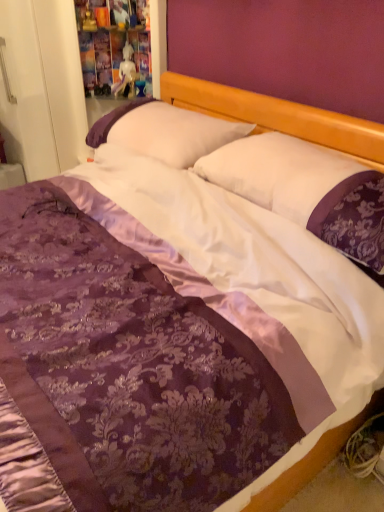
Looking at this image, how much space does white satin pillow at center, which appears as the first pillow when viewed from the back, occupy horizontally?

white satin pillow at center, which appears as the first pillow when viewed from the back, is 16.54 inches wide.

Describe the element at coordinates (126, 74) in the screenshot. Image resolution: width=384 pixels, height=512 pixels. I see `white glossy statue at upper center` at that location.

I want to click on white satin pillow at center, the second pillow viewed from the back, so click(307, 191).

In the scene shown: From the image's perspective, does white satin pillow at center, which appears as the first pillow when viewed from the back, appear lower than white glossy statue at upper center?

Yes, from the image's perspective, white satin pillow at center, which appears as the first pillow when viewed from the back, is beneath white glossy statue at upper center.

Find the location of a particular element. This screenshot has height=512, width=384. doll on the left of the white satin pillow at center, the second pillow viewed from the front is located at coordinates (126, 74).

Looking at this image, does white satin pillow at center, which appears as the first pillow when viewed from the back, appear on the right side of white glossy statue at upper center?

Correct, you'll find white satin pillow at center, which appears as the first pillow when viewed from the back, to the right of white glossy statue at upper center.

Which is behind, white satin pillow at center, the second pillow viewed from the front, or white glossy statue at upper center?

white glossy statue at upper center is further from the camera.

Does white satin pillow at center, the second pillow viewed from the back, have a smaller size compared to white glossy statue at upper center?

No, white satin pillow at center, the second pillow viewed from the back, is not smaller than white glossy statue at upper center.

Is white satin pillow at center, the second pillow viewed from the back, with white glossy statue at upper center?

white satin pillow at center, the second pillow viewed from the back, is not next to white glossy statue at upper center, and they're not touching.

Is white satin pillow at center, the 1th pillow positioned from the front, at the left side of white glossy statue at upper center?

No, white satin pillow at center, the 1th pillow positioned from the front, is not to the left of white glossy statue at upper center.

How different are the orientations of white satin pillow at center, the 1th pillow positioned from the front, and white glossy statue at upper center in degrees?

There is a 53-degree angle between the facing directions of white satin pillow at center, the 1th pillow positioned from the front, and white glossy statue at upper center.

Where is `doll on the left of white satin pillow at center, the second pillow viewed from the back`? This screenshot has width=384, height=512. doll on the left of white satin pillow at center, the second pillow viewed from the back is located at coordinates (126, 74).

Which object is thinner, white glossy statue at upper center or white satin pillow at center, the 1th pillow positioned from the front?

white glossy statue at upper center is thinner.

Could you tell me if white glossy statue at upper center is facing white satin pillow at center, the second pillow viewed from the back?

No, white glossy statue at upper center is not facing towards white satin pillow at center, the second pillow viewed from the back.

Where is `pillow behind the white satin pillow at center, the 1th pillow positioned from the front`? This screenshot has width=384, height=512. pillow behind the white satin pillow at center, the 1th pillow positioned from the front is located at coordinates (165, 131).

Based on the photo, from the image's perspective, is white satin pillow at center, the second pillow viewed from the front, located above or below white satin pillow at center, the 1th pillow positioned from the front?

From the image's perspective, white satin pillow at center, the second pillow viewed from the front, appears above white satin pillow at center, the 1th pillow positioned from the front.

Can you tell me how much white satin pillow at center, which appears as the first pillow when viewed from the back, and white satin pillow at center, the second pillow viewed from the back, differ in facing direction?

0.355 degrees separate the facing orientations of white satin pillow at center, which appears as the first pillow when viewed from the back, and white satin pillow at center, the second pillow viewed from the back.

Do you think white satin pillow at center, the 1th pillow positioned from the front, is within white satin pillow at center, which appears as the first pillow when viewed from the back, or outside of it?

white satin pillow at center, the 1th pillow positioned from the front, is not enclosed by white satin pillow at center, which appears as the first pillow when viewed from the back.

Is point (356, 263) positioned before point (135, 112)?

Yes.

Is white satin pillow at center, the second pillow viewed from the back, turned away from white satin pillow at center, the second pillow viewed from the front?

white satin pillow at center, the second pillow viewed from the back, does not have its back to white satin pillow at center, the second pillow viewed from the front.

Locate an element on the screen. The image size is (384, 512). pillow on the right side of white satin pillow at center, which appears as the first pillow when viewed from the back is located at coordinates (307, 191).

How different are the orientations of white glossy statue at upper center and white satin pillow at center, which appears as the first pillow when viewed from the back, in degrees?

The angular difference between white glossy statue at upper center and white satin pillow at center, which appears as the first pillow when viewed from the back, is 52.6 degrees.

Is white glossy statue at upper center taller than white satin pillow at center, the second pillow viewed from the front?

Indeed, white glossy statue at upper center has a greater height compared to white satin pillow at center, the second pillow viewed from the front.

Is white glossy statue at upper center to the left or to the right of white satin pillow at center, the second pillow viewed from the front, in the image?

white glossy statue at upper center is positioned on white satin pillow at center, the second pillow viewed from the front,'s left side.

Starting from the white glossy statue at upper center, which pillow is the 1st one in front? Please provide its 2D coordinates.

[(165, 131)]

Locate an element on the screen. The image size is (384, 512). doll lying above the white satin pillow at center, the second pillow viewed from the back (from the image's perspective) is located at coordinates (x=126, y=74).

Considering their positions, is white glossy statue at upper center positioned further to white satin pillow at center, the second pillow viewed from the back, than white satin pillow at center, the second pillow viewed from the front?

white glossy statue at upper center.

Considering their positions, is white satin pillow at center, the second pillow viewed from the back, positioned closer to white satin pillow at center, the second pillow viewed from the front, than white glossy statue at upper center?

Based on the image, white satin pillow at center, the second pillow viewed from the back, appears to be nearer to white satin pillow at center, the second pillow viewed from the front.

Looking at the image, which one is located closer to white glossy statue at upper center, white satin pillow at center, the second pillow viewed from the front, or white satin pillow at center, the 1th pillow positioned from the front?

white satin pillow at center, the second pillow viewed from the front.

Looking at the image, which one is located closer to white satin pillow at center, which appears as the first pillow when viewed from the back, white glossy statue at upper center or white satin pillow at center, the second pillow viewed from the back?

Based on the image, white satin pillow at center, the second pillow viewed from the back, appears to be nearer to white satin pillow at center, which appears as the first pillow when viewed from the back.

Estimate the real-world distances between objects in this image. Which object is further from white glossy statue at upper center, white satin pillow at center, the second pillow viewed from the back, or white satin pillow at center, the second pillow viewed from the front?

white satin pillow at center, the second pillow viewed from the back.

From the image, which object appears to be nearer to white satin pillow at center, the 1th pillow positioned from the front, white satin pillow at center, which appears as the first pillow when viewed from the back, or white glossy statue at upper center?

white satin pillow at center, which appears as the first pillow when viewed from the back, is closer to white satin pillow at center, the 1th pillow positioned from the front.

You are a GUI agent. You are given a task and a screenshot of the screen. Output one action in this format:
    pyautogui.click(x=<x>, y=<y>)
    Task: Click on the pillow between white satin pillow at center, the 1th pillow positioned from the front, and white glossy statue at upper center, along the z-axis
    Image resolution: width=384 pixels, height=512 pixels.
    Given the screenshot: What is the action you would take?
    pyautogui.click(x=165, y=131)